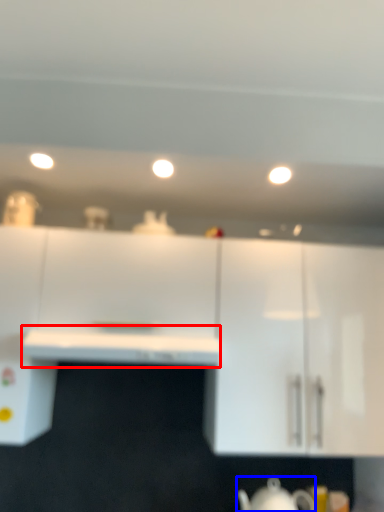
Question: Which point is closer to the camera, counter top (highlighted by a red box) or jug (highlighted by a blue box)?

Choices:
 (A) counter top
 (B) jug

Answer: (A)